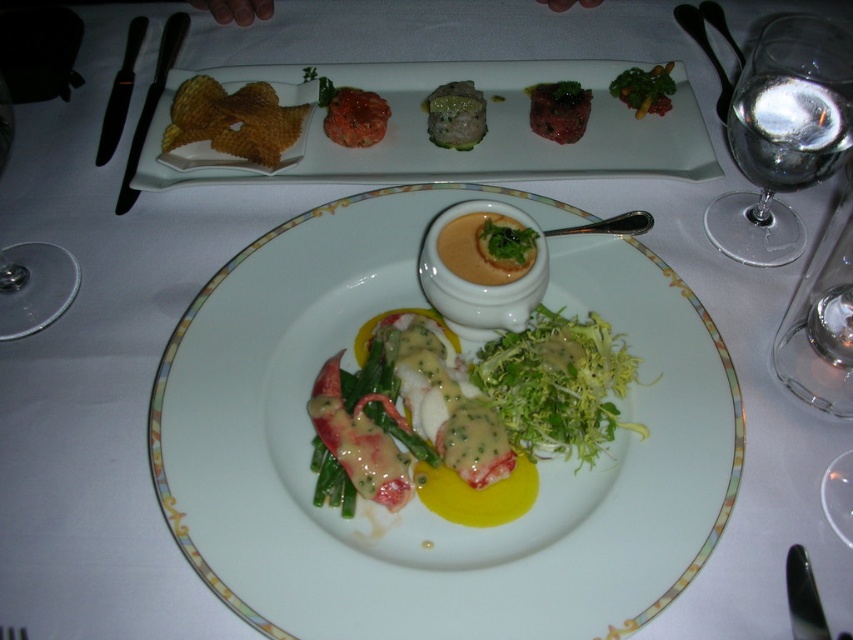
Question: Can you confirm if white glossy plate at center is smaller than savory meat at center?

Choices:
 (A) yes
 (B) no

Answer: (B)

Question: Which of the following is the closest to the observer?

Choices:
 (A) (62, 312)
 (B) (474, 77)

Answer: (A)

Question: Estimate the real-world distances between objects in this image. Which object is farther from the slightly browned meat at center?

Choices:
 (A) dark green crumbly at center
 (B) glazed ceramic plate at upper center
 (C) green leafy vegetable at upper center
 (D) black plastic knife at left

Answer: (D)

Question: Is transparent glass at left further to camera compared to savory meat at center?

Choices:
 (A) yes
 (B) no

Answer: (B)

Question: Considering the real-world distances, which object is farthest from the transparent glass at left?

Choices:
 (A) glossy metal spoon at upper center
 (B) dark green crumbly at center
 (C) glazed ceramic plate at upper center
 (D) green leafymaterial/texturevegetable at center

Answer: (A)

Question: Where is green leafymaterial/texturevegetable at center located in relation to transparent glass at left in the image?

Choices:
 (A) right
 (B) left

Answer: (A)